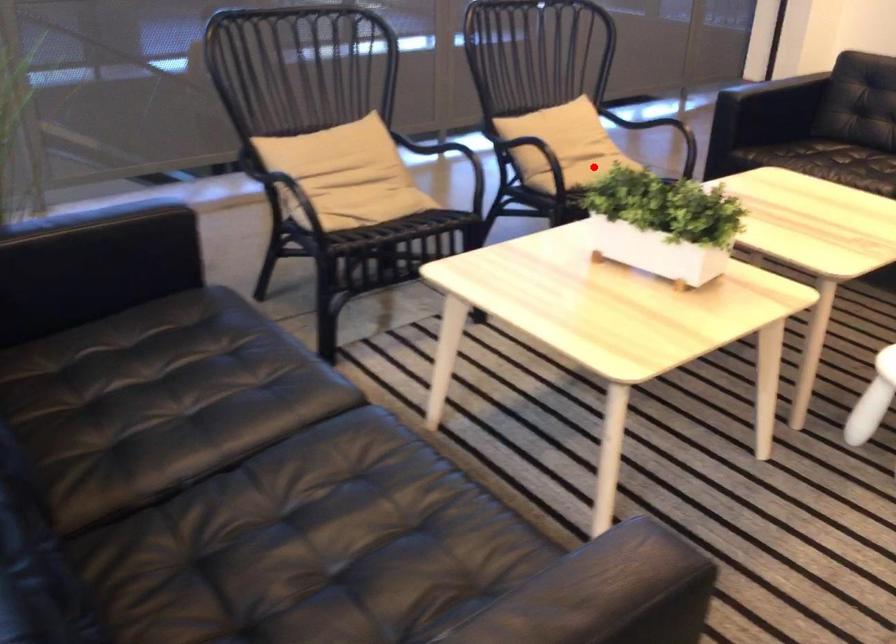
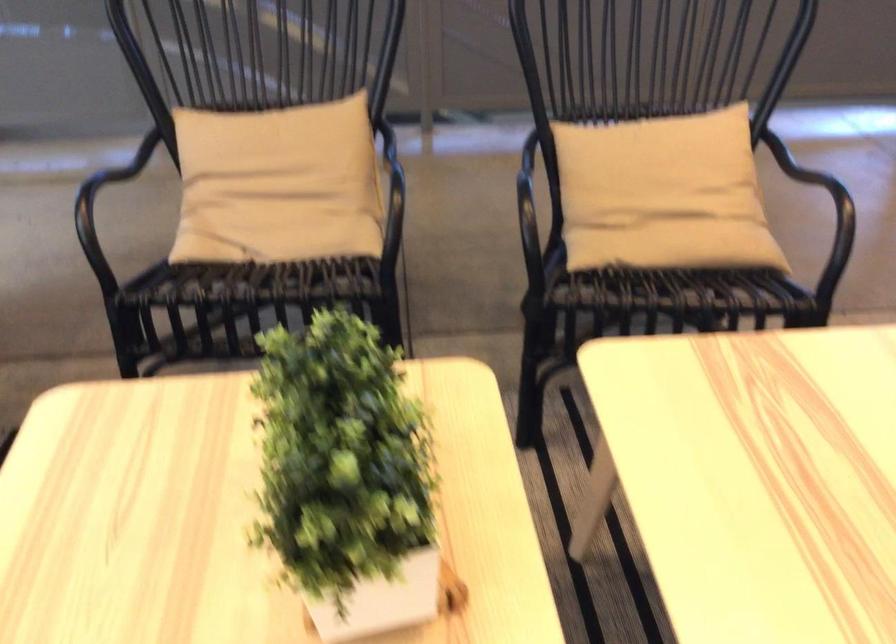
In the second image, find the point that corresponds to the highlighted location in the first image.

(674, 245)